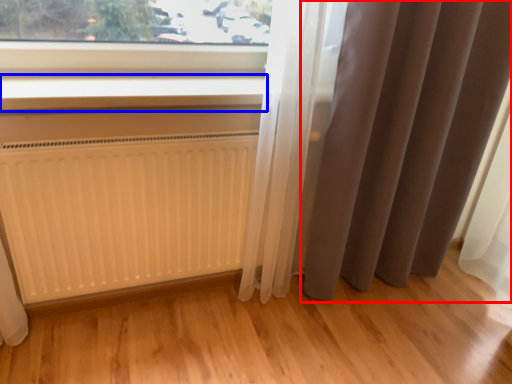
Question: Among these objects, which one is nearest to the camera, curtain (highlighted by a red box) or window sill (highlighted by a blue box)?

Choices:
 (A) curtain
 (B) window sill

Answer: (A)